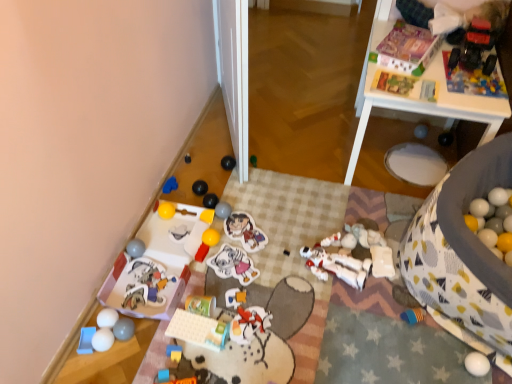
The image size is (512, 384). What are the coordinates of `free space to the left of white matte plush at center, which ranks as the 23th toy in left-to-right order` in the screenshot? It's located at (317, 270).